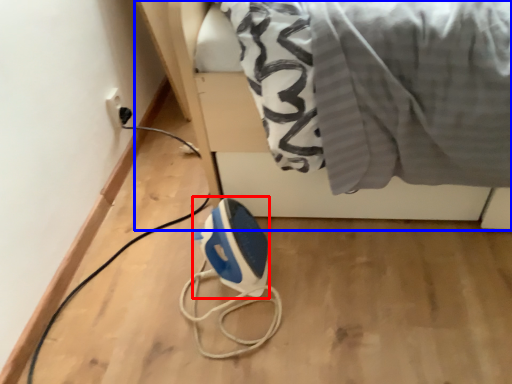
Question: Which object is further to the camera taking this photo, appliance (highlighted by a red box) or furniture (highlighted by a blue box)?

Choices:
 (A) appliance
 (B) furniture

Answer: (A)